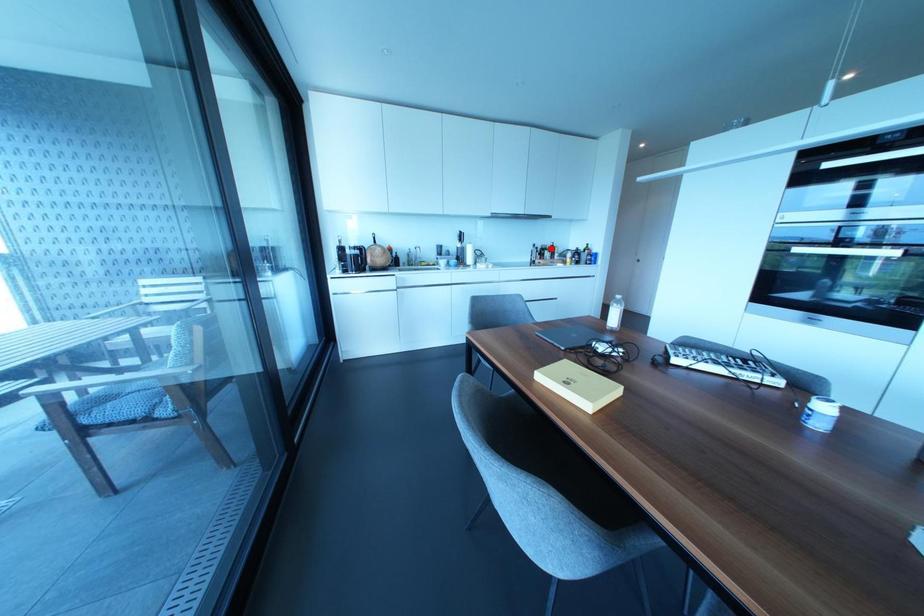
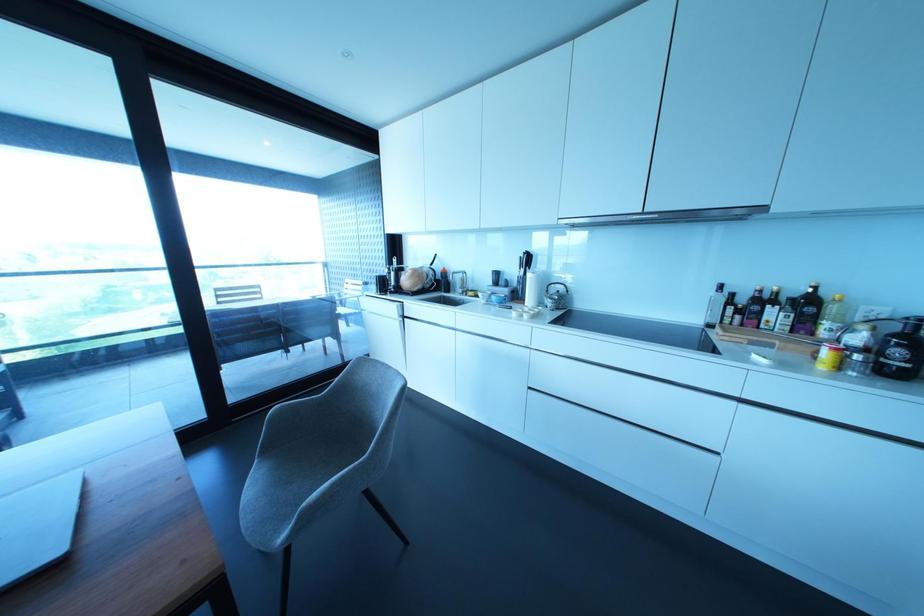
Locate, in the second image, the point that corresponds to the highlighted location in the first image.

(807, 304)